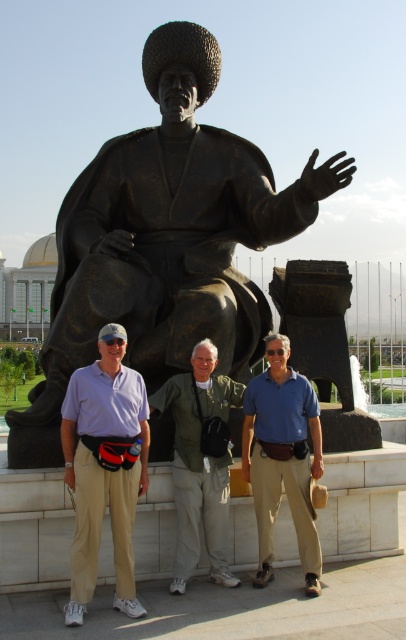
Question: Does matte black statue at center lie behind green fabric jacket at center?

Choices:
 (A) no
 (B) yes

Answer: (A)

Question: Estimate the real-world distances between objects in this image. Which object is closer to the green fabric jacket at center?

Choices:
 (A) blue cotton shirt at center
 (B) matte purple shirt at center
 (C) bronze statue at center

Answer: (A)

Question: Which of the following is the closest to the observer?

Choices:
 (A) matte purple shirt at center
 (B) green fabric jacket at center
 (C) bronze statue at center
 (D) blue cotton shirt at center

Answer: (A)

Question: Does bronze statue at center have a lesser width compared to green fabric jacket at center?

Choices:
 (A) no
 (B) yes

Answer: (A)

Question: Among these points, which one is nearest to the camera?

Choices:
 (A) (x=103, y=337)
 (B) (x=246, y=477)
 (C) (x=207, y=454)
 (D) (x=108, y=340)

Answer: (D)

Question: Does matte black statue at center appear on the right side of green fabric jacket at center?

Choices:
 (A) no
 (B) yes

Answer: (A)